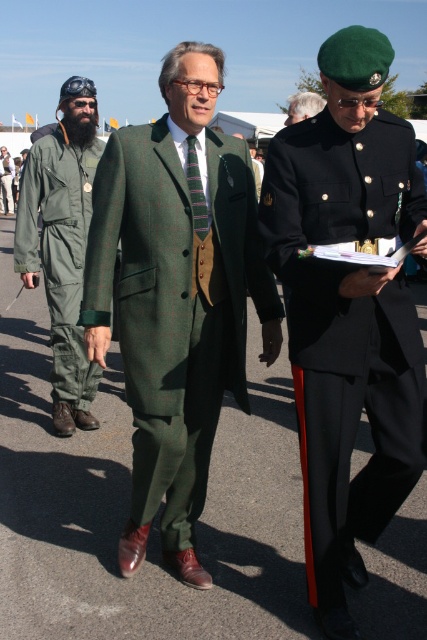
You are standing at point (x=5, y=176) and want to walk to point (x=101, y=273). Which direction should you move?

You should move forward because point (x=101, y=273) is in front of point (x=5, y=176).

You are a photographer trying to capture a group photo of the green wool suit at center and the green military uniform at left. Since you want to ensure both subjects are clearly visible, which subject should you focus on first to avoid blurriness caused by their movement?

The green military uniform at left has a greater width than the green wool suit at center, so focusing on the green military uniform at left first would be better since it occupies more space and might be more noticeable if blurred.

You are a fashion designer observing the two green wool garments at the center of the image. Which one has a longer length between the green wool coat at center and the green wool suit at center?

The green wool suit at center is longer than the green wool coat at center.